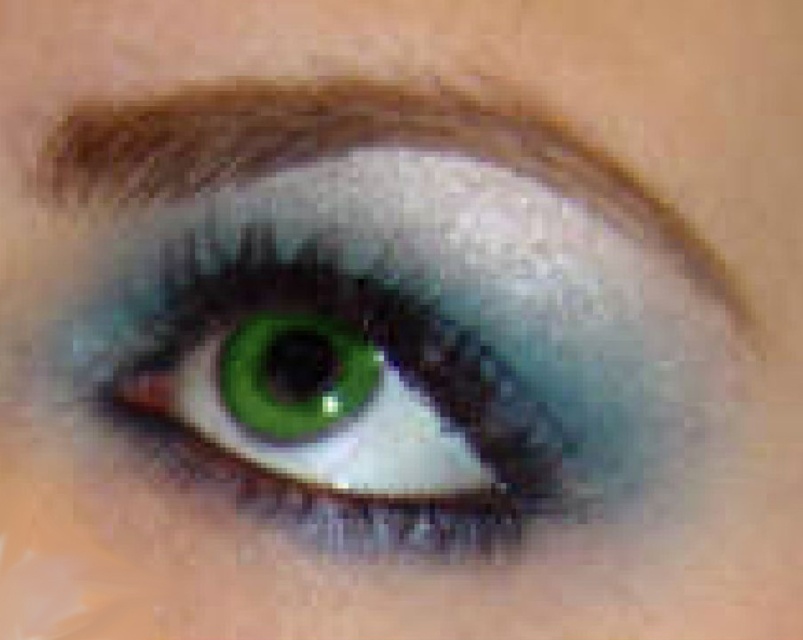
Does point (528, 372) come in front of point (408, 77)?

That is False.

Between point (321, 387) and point (698, 282), which one is positioned in front?

Point (698, 282)

Who is more distant from viewer, (382,358) or (442,99)?

Positioned behind is point (382,358).

Locate an element on the screen. The width and height of the screenshot is (803, 640). green matte eye at center is located at coordinates (333, 388).

Does point (219, 348) come farther from viewer compared to point (308, 378)?

Yes, it is.

The height and width of the screenshot is (640, 803). What are the coordinates of `green matte eye at center` in the screenshot? It's located at (333, 388).

Between point (376, 372) and point (291, 324), which one is positioned in front?

Point (291, 324) is in front.

Image resolution: width=803 pixels, height=640 pixels. In order to click on green matte eye at center in this screenshot , I will do `click(333, 388)`.

Describe the element at coordinates (353, 147) in the screenshot. I see `brown matte eyebrow at upper left` at that location.

Does brown matte eyebrow at upper left have a larger size compared to teal matte eye at center?

Yes, brown matte eyebrow at upper left is bigger than teal matte eye at center.

Who is more forward, (551, 145) or (251, 419)?

Point (551, 145) is in front.

At what (x,y) coordinates should I click in order to perform the action: click on brown matte eyebrow at upper left. Please return your answer as a coordinate pair (x, y). Looking at the image, I should click on (353, 147).